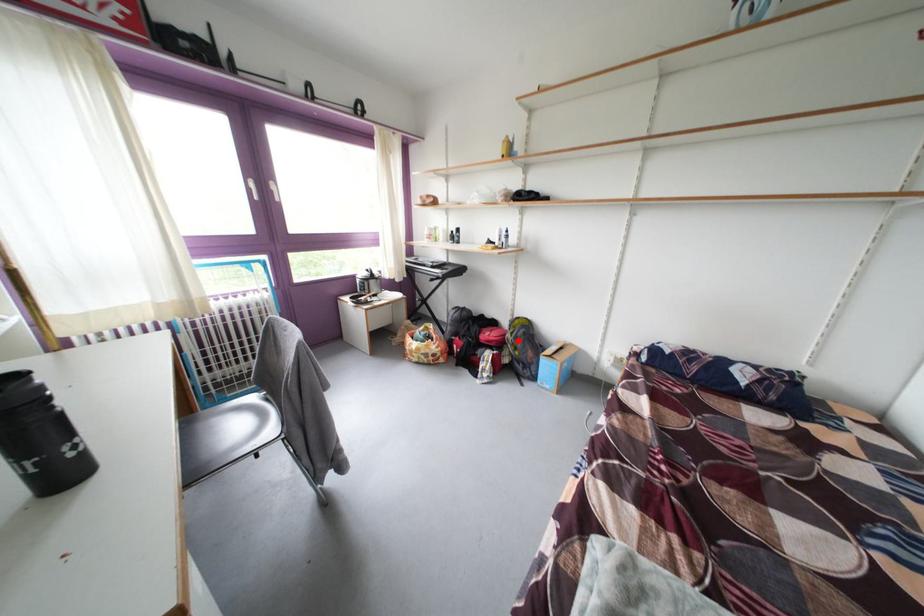
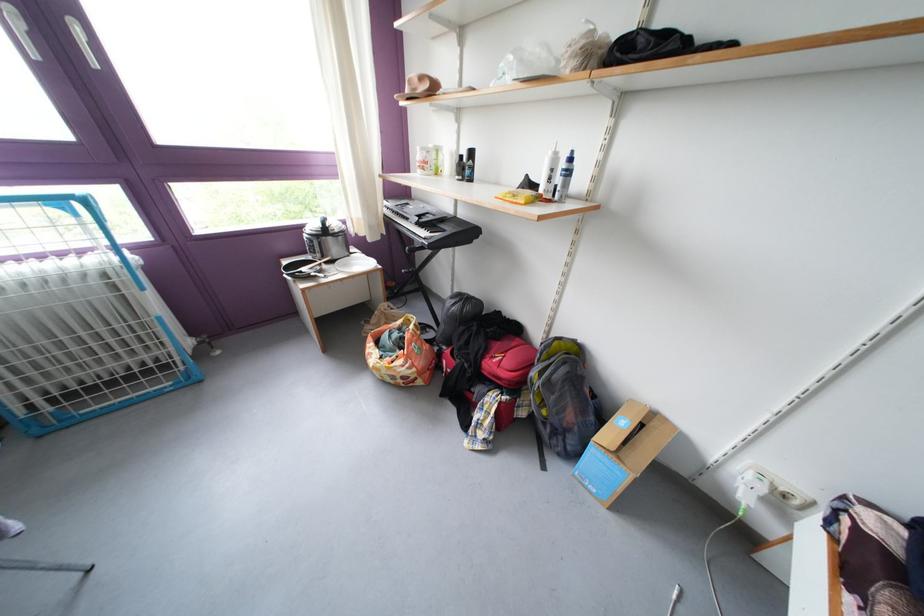
The point at the highlighted location is marked in the first image. Where is the corresponding point in the second image?

(543, 379)